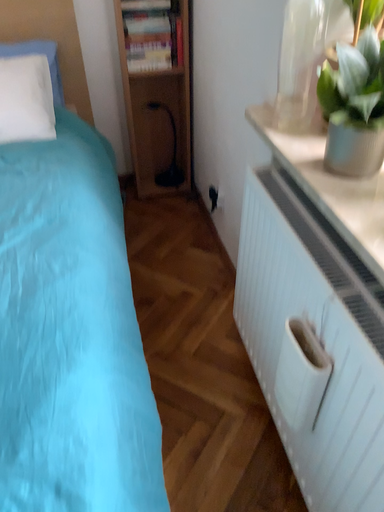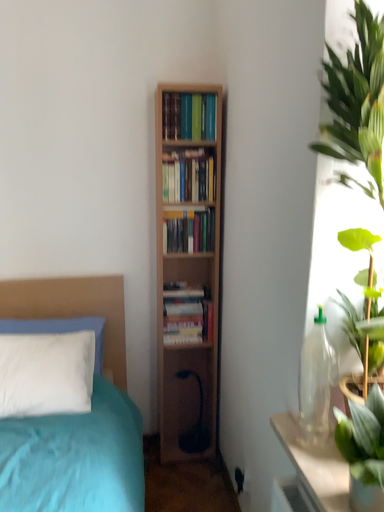
Question: Which way did the camera rotate in the video?

Choices:
 (A) rotated downward
 (B) rotated upward

Answer: (B)